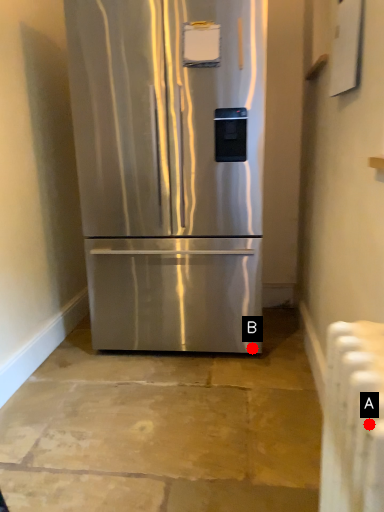
Question: Two points are circled on the image, labeled by A and B beside each circle. Among these points, which one is nearest to the camera?

Choices:
 (A) A is closer
 (B) B is closer

Answer: (A)